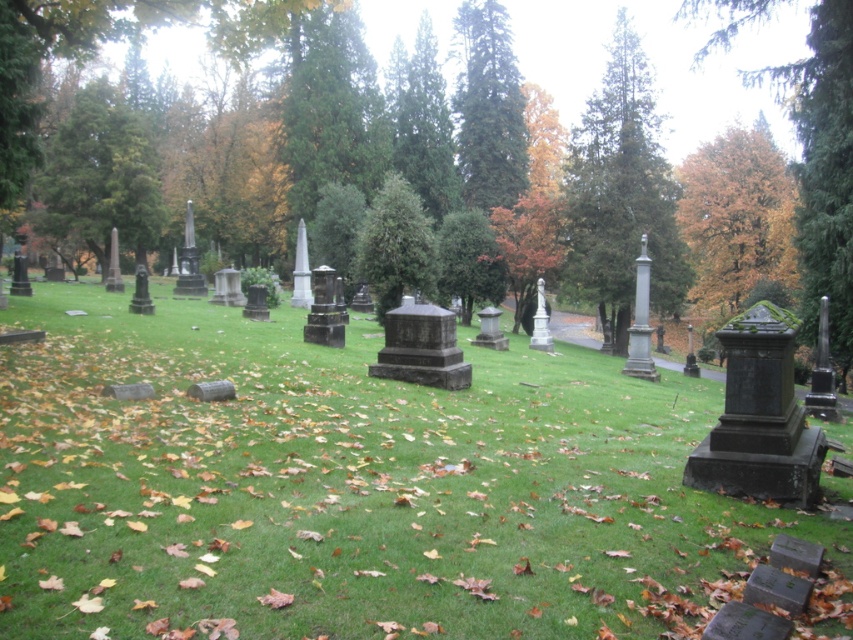
Does orange leafy tree at upper right have a lesser height compared to orange matte tree at center?

In fact, orange leafy tree at upper right may be taller than orange matte tree at center.

You are a GUI agent. You are given a task and a screenshot of the screen. Output one action in this format:
    pyautogui.click(x=<x>, y=<y>)
    Task: Click on the orange leafy tree at upper right
    The height and width of the screenshot is (640, 853).
    Given the screenshot: What is the action you would take?
    pyautogui.click(x=738, y=218)

Does orange leafy tree at upper right come behind green matte tree at center?

That is True.

Does orange leafy tree at upper right appear on the right side of green matte tree at center?

Correct, you'll find orange leafy tree at upper right to the right of green matte tree at center.

Is point (718, 157) in front of point (451, 252)?

That is False.

Where is `orange leafy tree at upper right`? orange leafy tree at upper right is located at coordinates 738,218.

Is point (241, 486) positioned in front of point (97, 209)?

Yes, point (241, 486) is in front of point (97, 209).

Who is positioned more to the left, green grassy at center or green textured tree at upper left?

green textured tree at upper left is more to the left.

Identify the location of green grassy at center. The height and width of the screenshot is (640, 853). (358, 486).